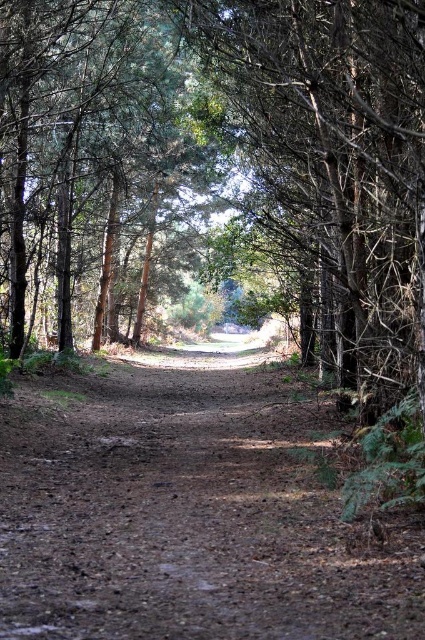
In the scene shown: A hiker is standing at the point marked by the coordinate point at point (272, 458). They want to walk to the nearest tree. How far will they have to walk?

The hiker will have to walk 8.64 meters to reach the nearest tree.

You are a hiker who wants to walk along the brown dirt track at center. You notice a green matte tree at center above you. Is the tree blocking your path?

A: The brown dirt track at center is below the green matte tree at center, so the tree is not blocking the path as it is positioned above it.

You are standing at the point labeled as point (186, 512) in the forest scene. The dirt path is at the center. Can you confirm if you are currently standing on the dirt path?

Yes, the point (186, 512) is on the brown dirt track at center, so you are standing on the dirt path.